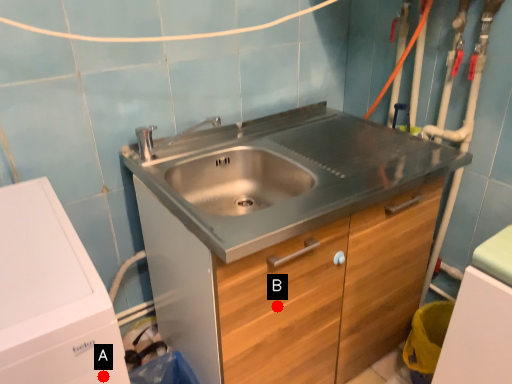
Question: Two points are circled on the image, labeled by A and B beside each circle. Which point is farther from the camera taking this photo?

Choices:
 (A) A is further
 (B) B is further

Answer: (B)